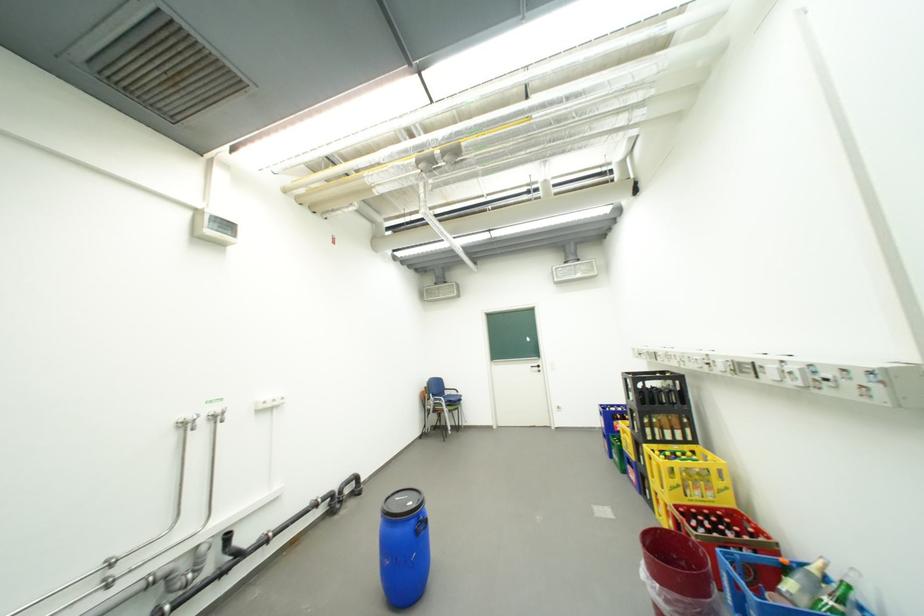
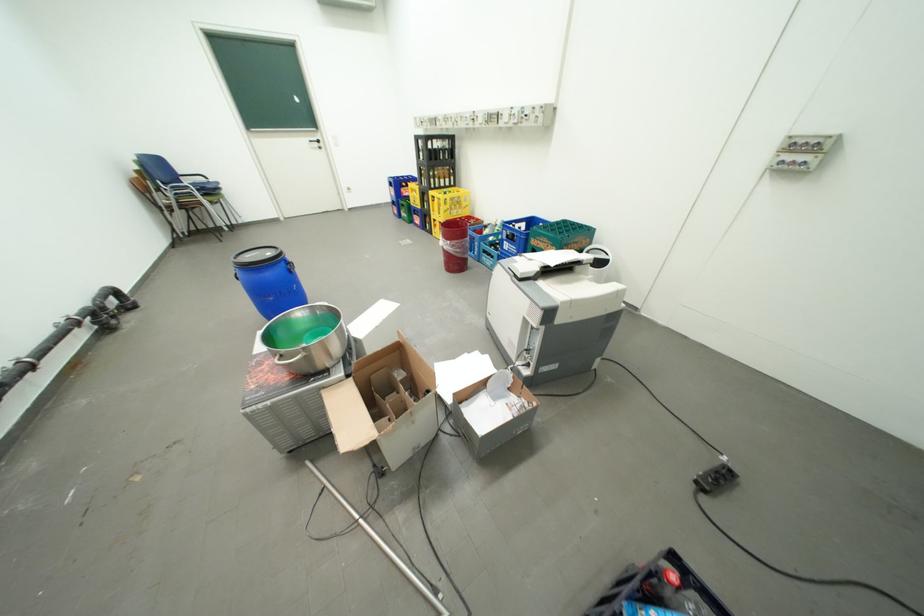
The point at (669, 586) is marked in the first image. Where is the corresponding point in the second image?

(459, 243)